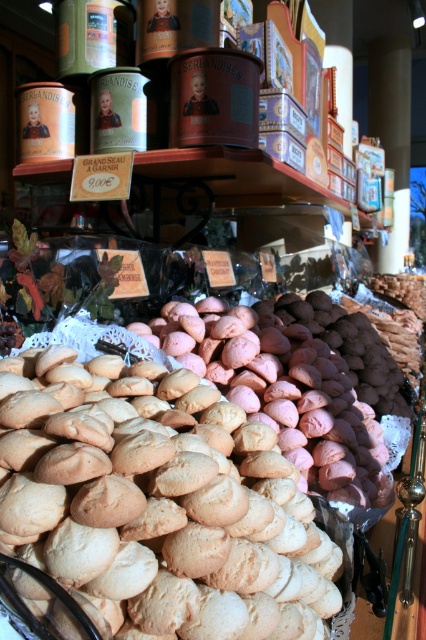
Question: Which point appears farthest from the camera in this image?

Choices:
 (A) (270, 323)
 (B) (239, 413)

Answer: (A)

Question: Which object is farther from the camera taking this photo?

Choices:
 (A) golden brown cookie at center
 (B) golden matte cookies at center

Answer: (B)

Question: Which object is closer to the camera taking this photo?

Choices:
 (A) golden matte cookies at center
 (B) golden brown cookie at center

Answer: (B)

Question: Is golden brown cookie at center thinner than golden matte cookies at center?

Choices:
 (A) yes
 (B) no

Answer: (A)

Question: Does golden brown cookie at center have a lesser width compared to golden matte cookies at center?

Choices:
 (A) yes
 (B) no

Answer: (A)

Question: Does golden brown cookie at center appear on the right side of golden matte cookies at center?

Choices:
 (A) yes
 (B) no

Answer: (B)